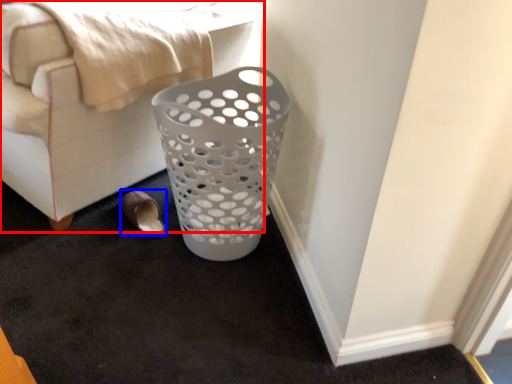
Question: Among these objects, which one is farthest to the camera, furniture (highlighted by a red box) or footwear (highlighted by a blue box)?

Choices:
 (A) furniture
 (B) footwear

Answer: (B)